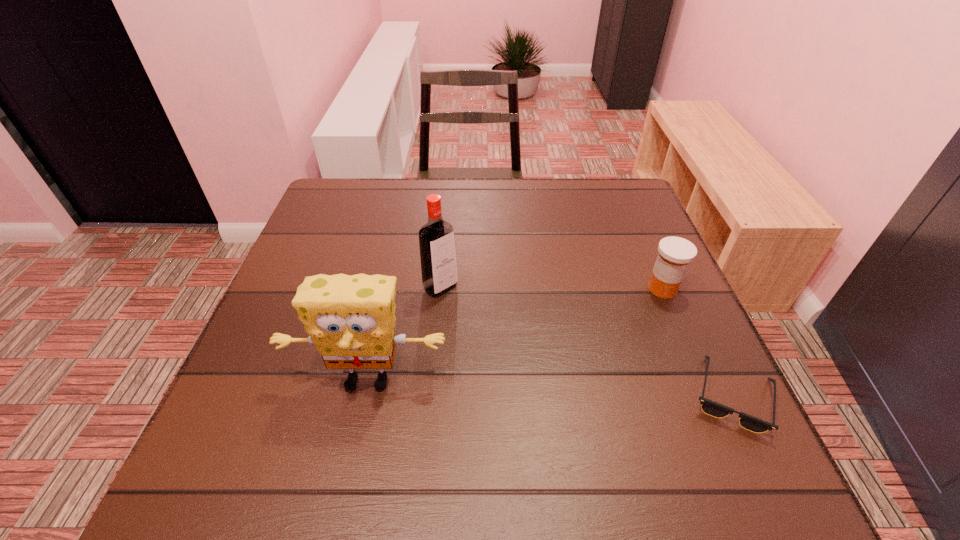
The image size is (960, 540). Identify the location of vacant space located 0.180m on the label of the second shortest object. (592, 329).

Image resolution: width=960 pixels, height=540 pixels. Find the location of `sponge present at the near edge`. sponge present at the near edge is located at coordinates click(x=351, y=319).

Locate an element on the screen. This screenshot has width=960, height=540. sunglasses at the near edge is located at coordinates (709, 407).

Where is `object at the left edge`? This screenshot has width=960, height=540. object at the left edge is located at coordinates (351, 319).

Locate an element on the screen. The image size is (960, 540). sunglasses present at the right edge is located at coordinates (709, 407).

Image resolution: width=960 pixels, height=540 pixels. I want to click on medicine at the right edge, so click(x=675, y=254).

The width and height of the screenshot is (960, 540). Find the location of `object situated at the near left corner`. object situated at the near left corner is located at coordinates (351, 319).

Image resolution: width=960 pixels, height=540 pixels. Identify the location of object that is positioned at the near right corner. (709, 407).

Where is `blank space at the far edge`? blank space at the far edge is located at coordinates (540, 190).

Locate an element on the screen. The image size is (960, 540). vacant space at the near edge is located at coordinates (404, 408).